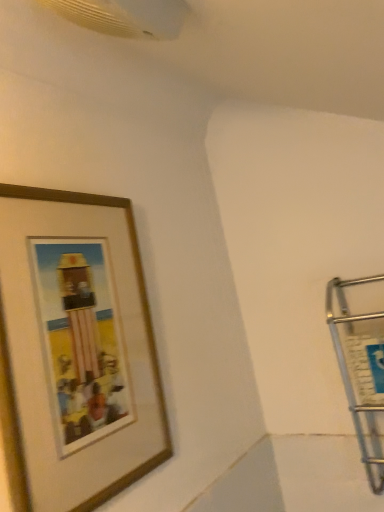
Question: From the image's perspective, is satin silver cart at right below wooden picture frame at upper left?

Choices:
 (A) yes
 (B) no

Answer: (A)

Question: Is satin silver cart at right to the right of wooden picture frame at upper left from the viewer's perspective?

Choices:
 (A) no
 (B) yes

Answer: (B)

Question: Does satin silver cart at right come behind wooden picture frame at upper left?

Choices:
 (A) yes
 (B) no

Answer: (A)

Question: Does satin silver cart at right have a lesser height compared to wooden picture frame at upper left?

Choices:
 (A) no
 (B) yes

Answer: (B)

Question: Does satin silver cart at right come in front of wooden picture frame at upper left?

Choices:
 (A) no
 (B) yes

Answer: (A)

Question: Can you see satin silver cart at right touching wooden picture frame at upper left?

Choices:
 (A) no
 (B) yes

Answer: (A)

Question: Considering the relative positions of wooden picture frame at upper left and satin silver cart at right in the image provided, is wooden picture frame at upper left to the right of satin silver cart at right from the viewer's perspective?

Choices:
 (A) yes
 (B) no

Answer: (B)

Question: Can you confirm if wooden picture frame at upper left is shorter than satin silver cart at right?

Choices:
 (A) no
 (B) yes

Answer: (A)

Question: Can satin silver cart at right be found inside wooden picture frame at upper left?

Choices:
 (A) yes
 (B) no

Answer: (B)

Question: Does wooden picture frame at upper left touch satin silver cart at right?

Choices:
 (A) yes
 (B) no

Answer: (B)

Question: Does wooden picture frame at upper left come in front of satin silver cart at right?

Choices:
 (A) yes
 (B) no

Answer: (A)

Question: From the image's perspective, is wooden picture frame at upper left under satin silver cart at right?

Choices:
 (A) yes
 (B) no

Answer: (B)

Question: Does point (6, 196) appear closer or farther from the camera than point (365, 416)?

Choices:
 (A) farther
 (B) closer

Answer: (B)